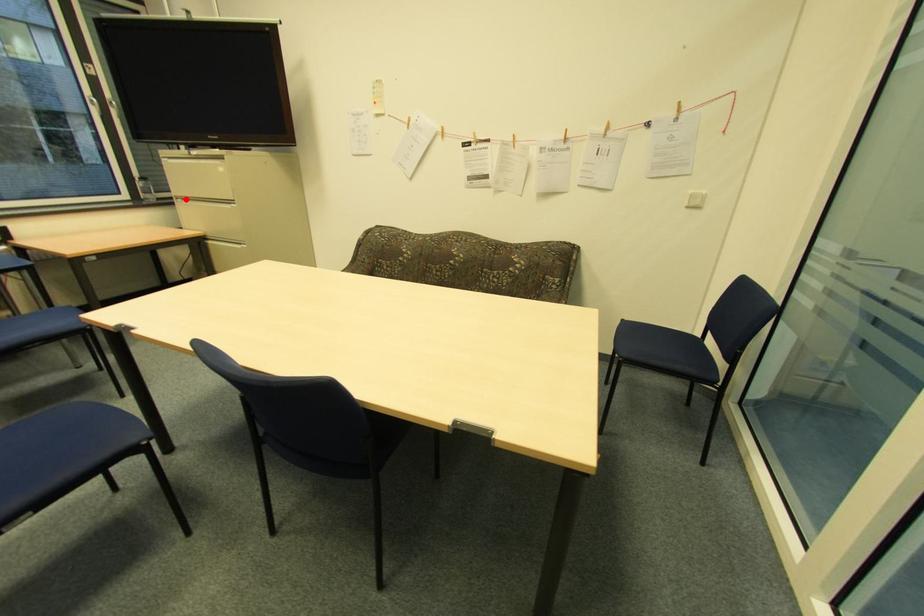
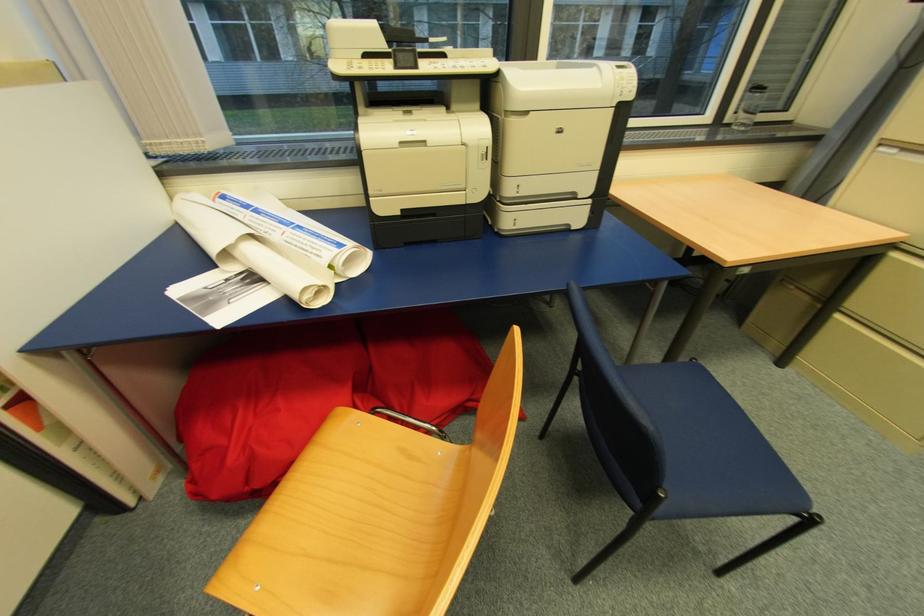
Question: I am providing you with two images of the same scene from different viewpoints. A red point is marked on the first image. Can you still see the location of the red point in image 2?

Choices:
 (A) Yes
 (B) No

Answer: (A)